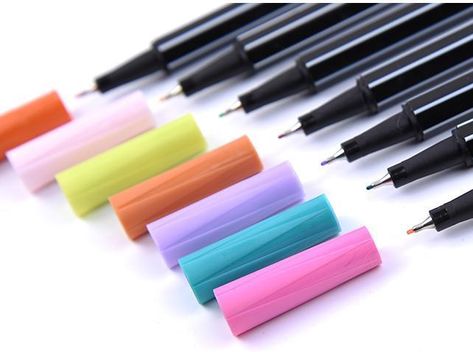
At what (x,y) coordinates should I click in order to perform the action: click on pens. Please return your answer as a coordinate pair (x, y). The image size is (473, 352). Looking at the image, I should click on (207, 19), (273, 41), (346, 46), (409, 70), (431, 107), (439, 159), (452, 217).